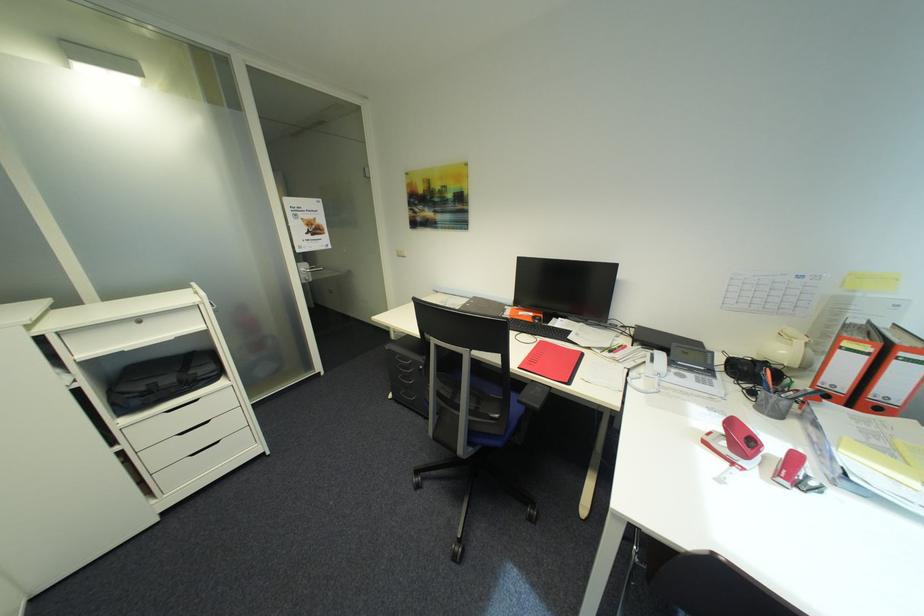
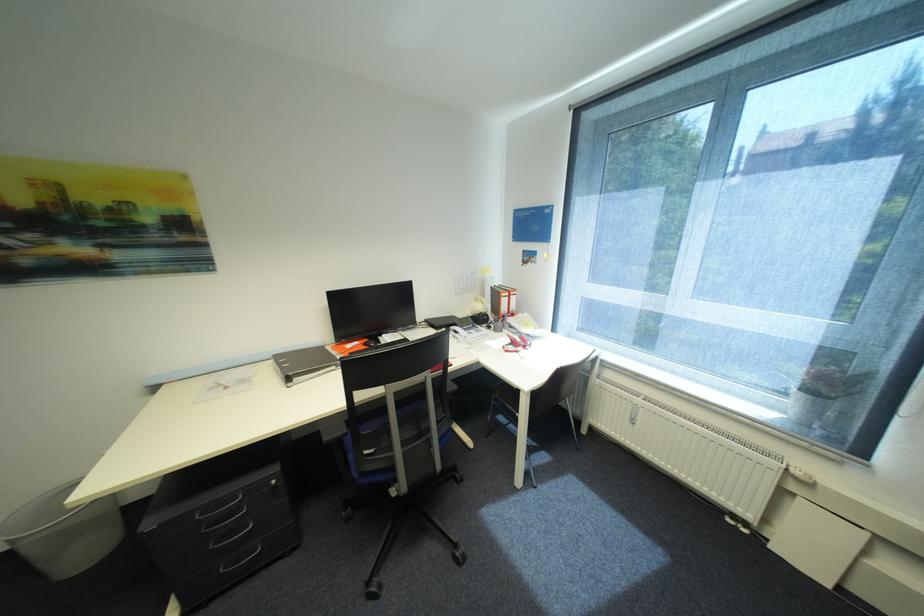
Question: The camera is either moving clockwise (left) or counter-clockwise (right) around the object. The first image is from the beginning of the video and the second image is from the end. Is the camera moving left or right when shooting the video?

Choices:
 (A) Left
 (B) Right

Answer: (A)